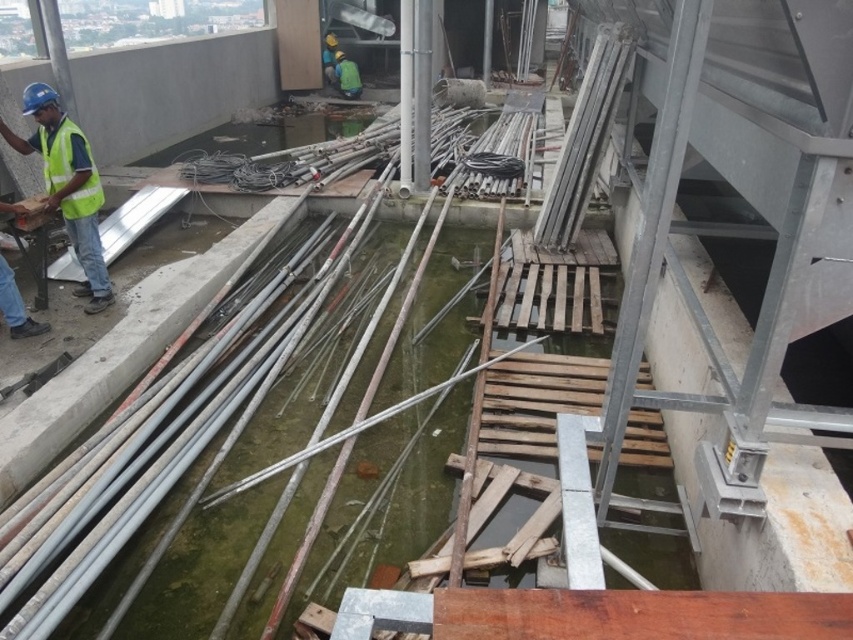
Question: Does yellow reflective vest at left have a lesser width compared to high-visibility fabric safety vest at left?

Choices:
 (A) yes
 (B) no

Answer: (B)

Question: Can you confirm if yellow reflective vest at left is positioned to the right of high-visibility fabric safety vest at left?

Choices:
 (A) no
 (B) yes

Answer: (A)

Question: Which point is farther from the camera taking this photo?

Choices:
 (A) pyautogui.click(x=85, y=145)
 (B) pyautogui.click(x=68, y=198)

Answer: (B)

Question: Can you confirm if yellow reflective vest at left is thinner than high-visibility fabric safety vest at left?

Choices:
 (A) no
 (B) yes

Answer: (A)